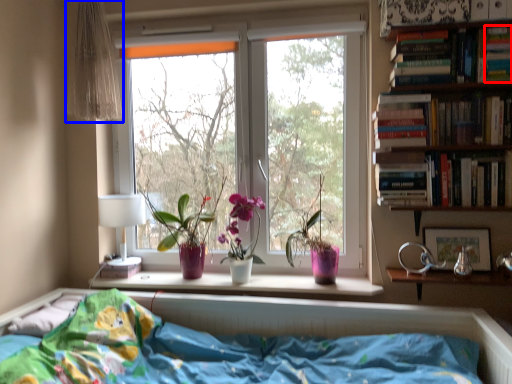
Question: Which point is further to the camera, paperback book (highlighted by a red box) or curtain (highlighted by a blue box)?

Choices:
 (A) paperback book
 (B) curtain

Answer: (B)